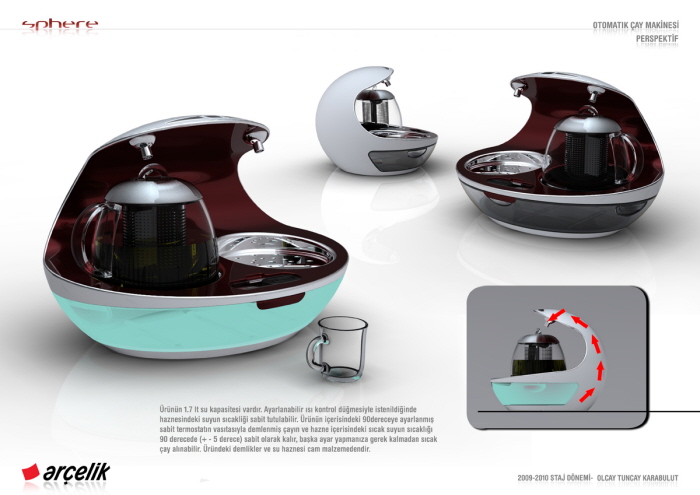
At what (x,y) coordinates should I click in order to perform the action: click on glass. Please return your answer as a coordinate pair (x, y). Looking at the image, I should click on (336, 346).